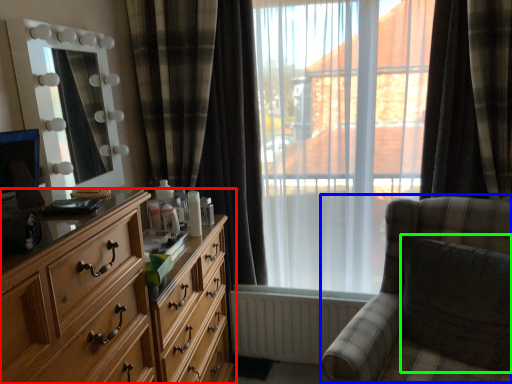
Question: Estimate the real-world distances between objects in this image. Which object is closer to chest of drawers (highlighted by a red box), rocking chair (highlighted by a blue box) or swivel chair (highlighted by a green box)?

Choices:
 (A) rocking chair
 (B) swivel chair

Answer: (A)